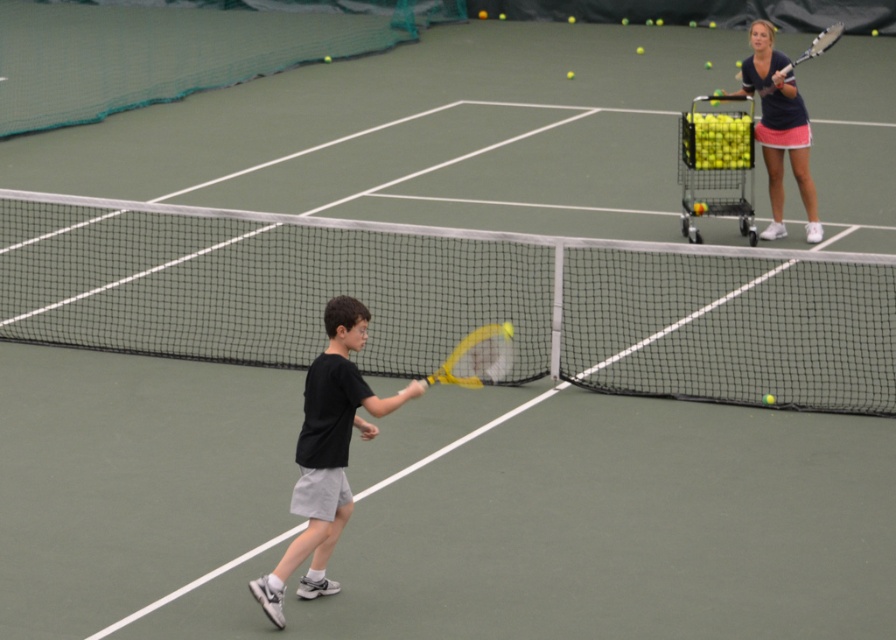
Looking at this image, you are a tennis instructor trying to retrieve a ball from the court. You see the black matte tennis racket at center and the metallic yellow shopping cart at upper right. Which object is closer to the ground?

The black matte tennis racket at center is closer to the ground since it is positioned below the metallic yellow shopping cart at upper right.

You are a tennis instructor trying to select a racket for a beginner student. You have two options in the image, the black matte tennis racket at center and the matte blue tennis racket at upper right. Based on their sizes, which one is shorter?

The black matte tennis racket at center is not as tall as matte blue tennis racket at upper right, so the black matte tennis racket at center is shorter.

You are a tennis coach preparing for a lesson. You have two rackets available in the scene. Which racket is smaller in size between the black matte tennis racket at center and the matte blue tennis racket at upper right?

The black matte tennis racket at center is smaller in size compared to the matte blue tennis racket at upper right.